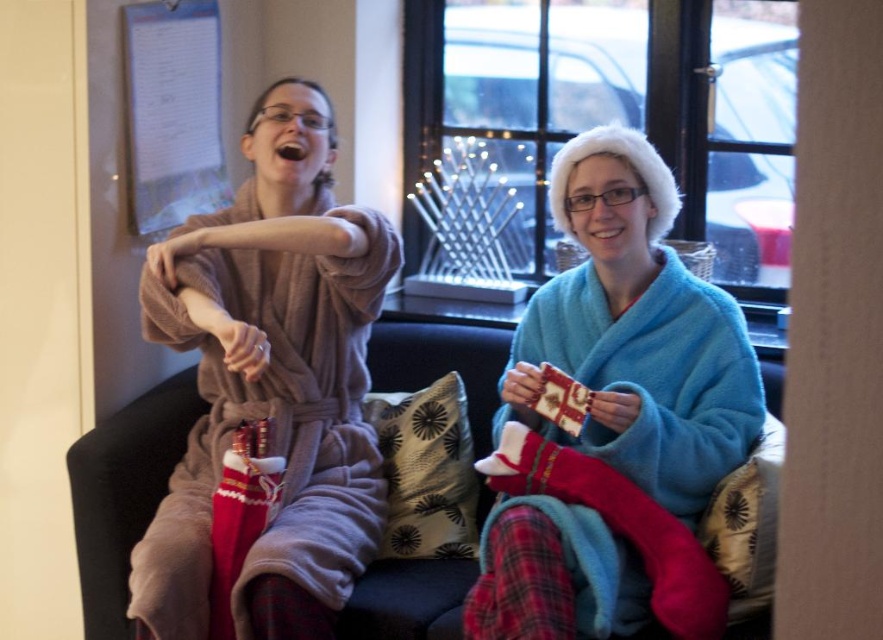
Question: Which point is closer to the camera taking this photo?

Choices:
 (A) (421, 340)
 (B) (179, 177)
 (C) (587, 593)

Answer: (C)

Question: Considering the real-world distances, which object is farthest from the blue fuzzy robe at center?

Choices:
 (A) velvet couch at center
 (B) soft brown robe at left

Answer: (A)

Question: Can you confirm if blue fuzzy robe at center is positioned above soft brown robe at left?

Choices:
 (A) no
 (B) yes

Answer: (B)

Question: From the image, what is the correct spatial relationship of velvet couch at center in relation to white paper at upper left?

Choices:
 (A) right
 (B) left

Answer: (B)

Question: Is velvet couch at center bigger than white paper at upper left?

Choices:
 (A) yes
 (B) no

Answer: (A)

Question: Estimate the real-world distances between objects in this image. Which object is farther from the soft brown robe at left?

Choices:
 (A) blue fuzzy robe at center
 (B) velvet couch at center
 (C) white paper at upper left

Answer: (C)